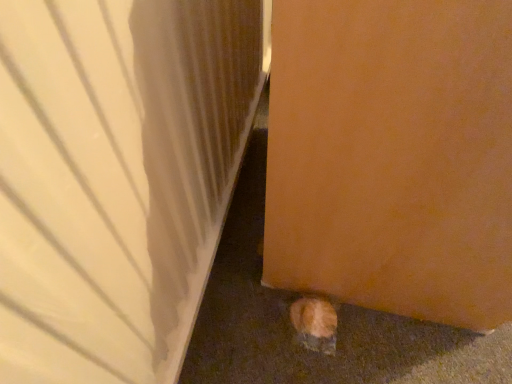
The height and width of the screenshot is (384, 512). Describe the element at coordinates (315, 324) in the screenshot. I see `orange fur cat at lower right` at that location.

The width and height of the screenshot is (512, 384). Describe the element at coordinates (117, 177) in the screenshot. I see `matte wood door at lower right, positioned as the first door in left-to-right order` at that location.

Image resolution: width=512 pixels, height=384 pixels. Identify the location of orange matte door at lower right, the 2th door from the left. (393, 156).

Considering the relative sizes of matte wood door at lower right, acting as the 2th door starting from the right, and orange fur cat at lower right in the image provided, is matte wood door at lower right, acting as the 2th door starting from the right, shorter than orange fur cat at lower right?

In fact, matte wood door at lower right, acting as the 2th door starting from the right, may be taller than orange fur cat at lower right.

Is point (77, 329) closer or farther from the camera than point (334, 309)?

Point (77, 329) appears to be closer to the viewer than point (334, 309).

Considering the positions of objects matte wood door at lower right, acting as the 2th door starting from the right, and orange fur cat at lower right in the image provided, who is more to the left, matte wood door at lower right, acting as the 2th door starting from the right, or orange fur cat at lower right?

From the viewer's perspective, matte wood door at lower right, acting as the 2th door starting from the right, appears more on the left side.

Is matte wood door at lower right, positioned as the first door in left-to-right order, looking in the opposite direction of orange fur cat at lower right?

No, matte wood door at lower right, positioned as the first door in left-to-right order, is not facing away from orange fur cat at lower right.

Considering the positions of objects matte wood door at lower right, positioned as the first door in left-to-right order, and orange matte door at lower right, the 2th door from the left, in the image provided, who is in front, matte wood door at lower right, positioned as the first door in left-to-right order, or orange matte door at lower right, the 2th door from the left,?

matte wood door at lower right, positioned as the first door in left-to-right order, is more forward.

From the image's perspective, who appears lower, matte wood door at lower right, acting as the 2th door starting from the right, or orange matte door at lower right, the 2th door from the left?

matte wood door at lower right, acting as the 2th door starting from the right, from the image's perspective.

What are the coordinates of `door lying above the matte wood door at lower right, acting as the 2th door starting from the right (from the image's perspective)` in the screenshot? It's located at (393, 156).

How different are the orientations of matte wood door at lower right, positioned as the first door in left-to-right order, and orange matte door at lower right, the 2th door from the left, in degrees?

The angular difference between matte wood door at lower right, positioned as the first door in left-to-right order, and orange matte door at lower right, the 2th door from the left, is 1.44 degrees.

Is orange fur cat at lower right wider than matte wood door at lower right, positioned as the first door in left-to-right order?

No, orange fur cat at lower right is not wider than matte wood door at lower right, positioned as the first door in left-to-right order.

Is matte wood door at lower right, positioned as the first door in left-to-right order, at the back of orange fur cat at lower right?

Yes.

Does orange fur cat at lower right appear on the left side of matte wood door at lower right, acting as the 2th door starting from the right?

No.

Is orange fur cat at lower right far from matte wood door at lower right, acting as the 2th door starting from the right?

They are positioned close to each other.

Between orange matte door at lower right, which appears as the 1th door when viewed from the right, and matte wood door at lower right, acting as the 2th door starting from the right, which one has smaller size?

matte wood door at lower right, acting as the 2th door starting from the right.

Does point (444, 158) lie behind point (12, 220)?

Yes, it is.

Considering the sizes of objects orange matte door at lower right, which appears as the 1th door when viewed from the right, and matte wood door at lower right, positioned as the first door in left-to-right order, in the image provided, who is taller, orange matte door at lower right, which appears as the 1th door when viewed from the right, or matte wood door at lower right, positioned as the first door in left-to-right order,?

matte wood door at lower right, positioned as the first door in left-to-right order.

How far apart are orange fur cat at lower right and orange matte door at lower right, the 2th door from the left?

The distance of orange fur cat at lower right from orange matte door at lower right, the 2th door from the left, is 12.75 inches.

Identify the location of door that is the 2nd one when counting upward from the orange fur cat at lower right (from the image's perspective). The image size is (512, 384). (393, 156).

From the image's perspective, which object appears higher, orange fur cat at lower right or orange matte door at lower right, the 2th door from the left?

From the image's view, orange matte door at lower right, the 2th door from the left, is above.

Does orange fur cat at lower right have a lesser height compared to orange matte door at lower right, which appears as the 1th door when viewed from the right?

Indeed, orange fur cat at lower right has a lesser height compared to orange matte door at lower right, which appears as the 1th door when viewed from the right.

Between orange matte door at lower right, which appears as the 1th door when viewed from the right, and orange fur cat at lower right, which one has less height?

orange fur cat at lower right.

Which is closer to the camera, (437, 312) or (320, 336)?

Point (437, 312).

Considering the sizes of objects orange matte door at lower right, the 2th door from the left, and orange fur cat at lower right in the image provided, who is wider, orange matte door at lower right, the 2th door from the left, or orange fur cat at lower right?

orange matte door at lower right, the 2th door from the left, is wider.

From a real-world perspective, is orange matte door at lower right, the 2th door from the left, over orange fur cat at lower right?

Yes, from a real-world perspective, orange matte door at lower right, the 2th door from the left, is above orange fur cat at lower right.

This screenshot has width=512, height=384. I want to click on animal located underneath the matte wood door at lower right, acting as the 2th door starting from the right (from a real-world perspective), so click(315, 324).

What are the coordinates of `door in front of the orange matte door at lower right, the 2th door from the left` in the screenshot? It's located at (117, 177).

Looking at this image, from the image, which object appears to be nearer to matte wood door at lower right, acting as the 2th door starting from the right, orange matte door at lower right, which appears as the 1th door when viewed from the right, or orange fur cat at lower right?

The object closer to matte wood door at lower right, acting as the 2th door starting from the right, is orange matte door at lower right, which appears as the 1th door when viewed from the right.

Which object lies nearer to the anchor point orange fur cat at lower right, matte wood door at lower right, acting as the 2th door starting from the right, or orange matte door at lower right, which appears as the 1th door when viewed from the right?

orange matte door at lower right, which appears as the 1th door when viewed from the right.

From the image, which object appears to be farther from orange fur cat at lower right, orange matte door at lower right, which appears as the 1th door when viewed from the right, or matte wood door at lower right, positioned as the first door in left-to-right order?

matte wood door at lower right, positioned as the first door in left-to-right order.

Based on their spatial positions, is matte wood door at lower right, acting as the 2th door starting from the right, or orange fur cat at lower right closer to orange matte door at lower right, the 2th door from the left?

Based on the image, matte wood door at lower right, acting as the 2th door starting from the right, appears to be nearer to orange matte door at lower right, the 2th door from the left.

When comparing their distances from orange matte door at lower right, which appears as the 1th door when viewed from the right, does orange fur cat at lower right or matte wood door at lower right, positioned as the first door in left-to-right order, seem further?

orange fur cat at lower right lies further to orange matte door at lower right, which appears as the 1th door when viewed from the right, than the other object.

Considering their positions, is orange fur cat at lower right positioned further to matte wood door at lower right, acting as the 2th door starting from the right, than orange matte door at lower right, which appears as the 1th door when viewed from the right?

orange fur cat at lower right is positioned further to the anchor matte wood door at lower right, acting as the 2th door starting from the right.

Identify the location of door between matte wood door at lower right, positioned as the first door in left-to-right order, and orange fur cat at lower right, along the z-axis. (393, 156).